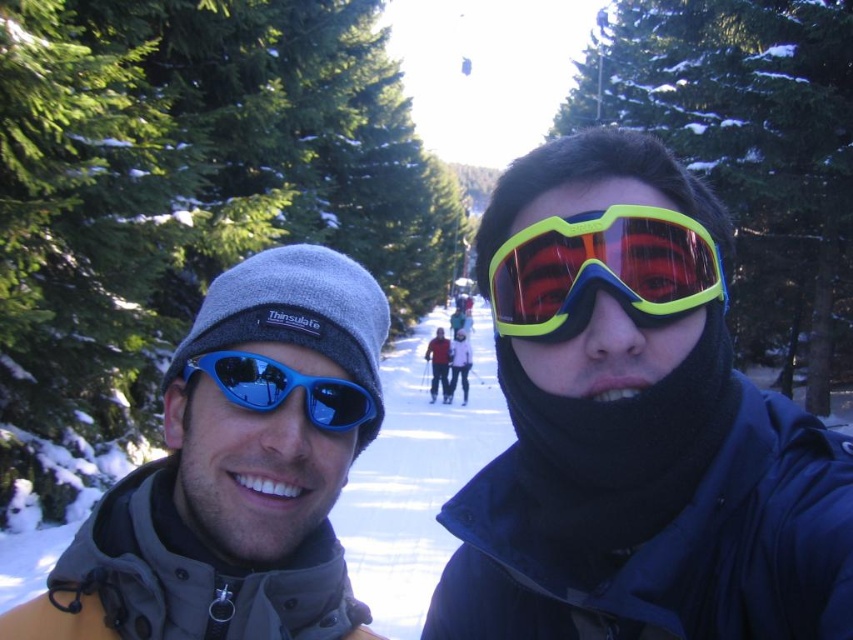
Does neon yellow plastic goggles at center appear on the left side of matte blue sunglasses at center?

In fact, neon yellow plastic goggles at center is to the right of matte blue sunglasses at center.

Is neon yellow plastic goggles at center shorter than matte blue sunglasses at center?

Yes, neon yellow plastic goggles at center is shorter than matte blue sunglasses at center.

The image size is (853, 640). In order to click on neon yellow plastic goggles at center in this screenshot , I will do pos(602,272).

In the scene shown: Does matte blue sunglasses at left have a smaller size compared to blue reflective sunglasses at left?

No, matte blue sunglasses at left is not smaller than blue reflective sunglasses at left.

Who is more forward, (323,550) or (334,396)?

Point (334,396)

Locate an element on the screen. The height and width of the screenshot is (640, 853). matte blue sunglasses at left is located at coordinates (236, 470).

How much distance is there between matte black ski goggles at center and matte blue ski at center?

matte black ski goggles at center and matte blue ski at center are 19.16 meters apart.

Who is more distant from viewer, [634,445] or [466,397]?

The point [466,397] is behind.

Find the location of a particular element. The width and height of the screenshot is (853, 640). matte black ski goggles at center is located at coordinates (635, 428).